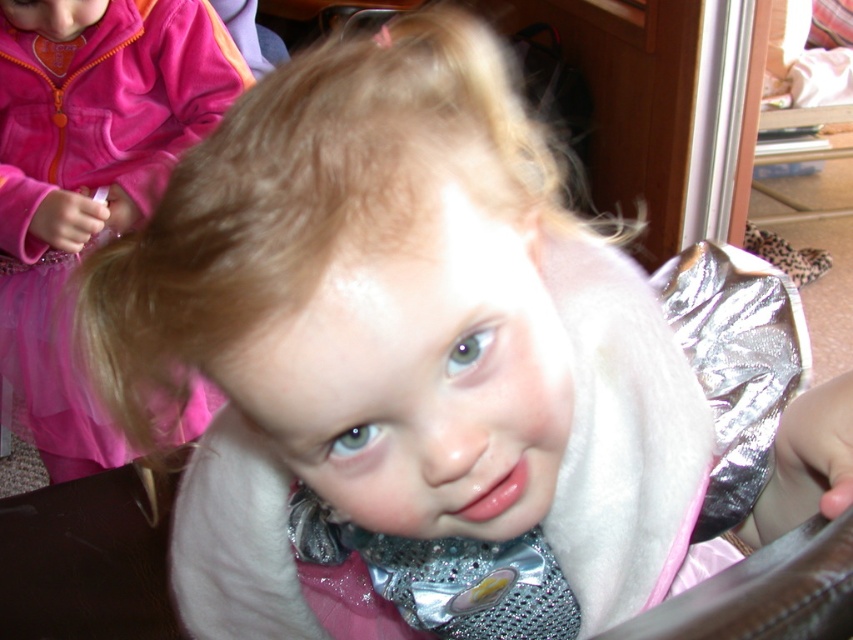
Question: Observing the image, what is the correct spatial positioning of matte pink dress at upper left in reference to silver reflective foil at center?

Choices:
 (A) above
 (B) below

Answer: (A)

Question: Does matte pink dress at upper left appear under silver reflective foil at center?

Choices:
 (A) no
 (B) yes

Answer: (A)

Question: Is the position of matte pink dress at upper left less distant than that of silver reflective foil at center?

Choices:
 (A) yes
 (B) no

Answer: (B)

Question: Which point is farther from the camera taking this photo?

Choices:
 (A) (28, 256)
 (B) (738, 262)

Answer: (A)

Question: Which point is farther from the camera taking this photo?

Choices:
 (A) (181, 4)
 (B) (764, 342)

Answer: (A)